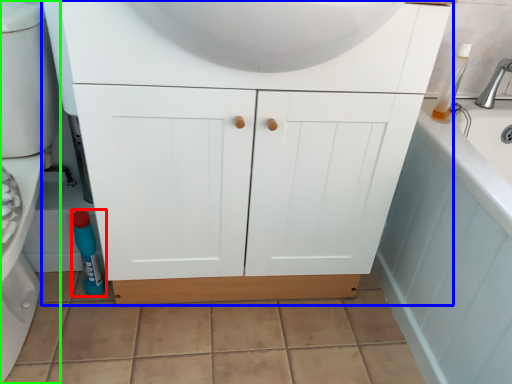
Question: Which object is positioned closest to bottle (highlighted by a red box)? Select from bathroom cabinet (highlighted by a blue box) and porcelain (highlighted by a green box).

Choices:
 (A) bathroom cabinet
 (B) porcelain

Answer: (B)